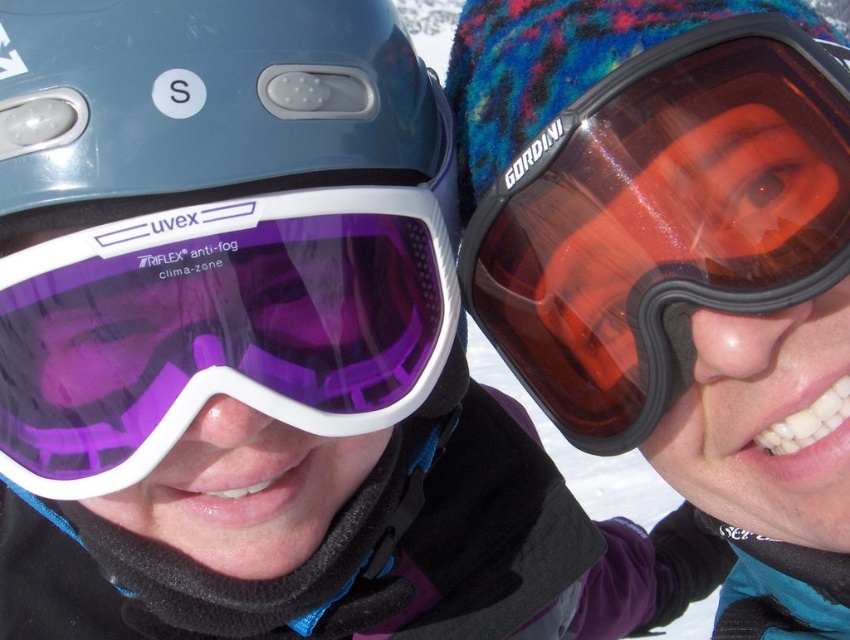
From the picture: You are a photographer trying to capture a closeup shot of the translucent amber lens goggles at right. Your camera has a minimum focusing distance of 50 centimeters. Will you be able to take the photo without moving closer than 50 centimeters?

The translucent amber lens goggles at right are 70.66 centimeters away from the camera, which is beyond the minimum focusing distance of 50 centimeters. Therefore, you can take the closeup shot without needing to move closer than 50 centimeters.

You are a ski equipment inspector checking the goggles of two skiers. The skier on the left has the purple matte ski goggles at left, and the skier on the right has the translucent amber lens goggles at right. Based on the equipment specifications, which pair of goggles has a taller height?

The translucent amber lens goggles at right has a greater height compared to the purple matte ski goggles at left, so the goggles on the right are taller.

You are a photographer trying to capture both the translucent amber lens goggles at right and the purple matte ski goggles at left in a single frame. Which goggles should you focus on first if you want to ensure both are in the frame without moving the camera?

The translucent amber lens goggles at right is positioned on the right side of purple matte ski goggles at left, so you should focus on the purple matte ski goggles at left first to ensure both are in the frame without moving the camera.